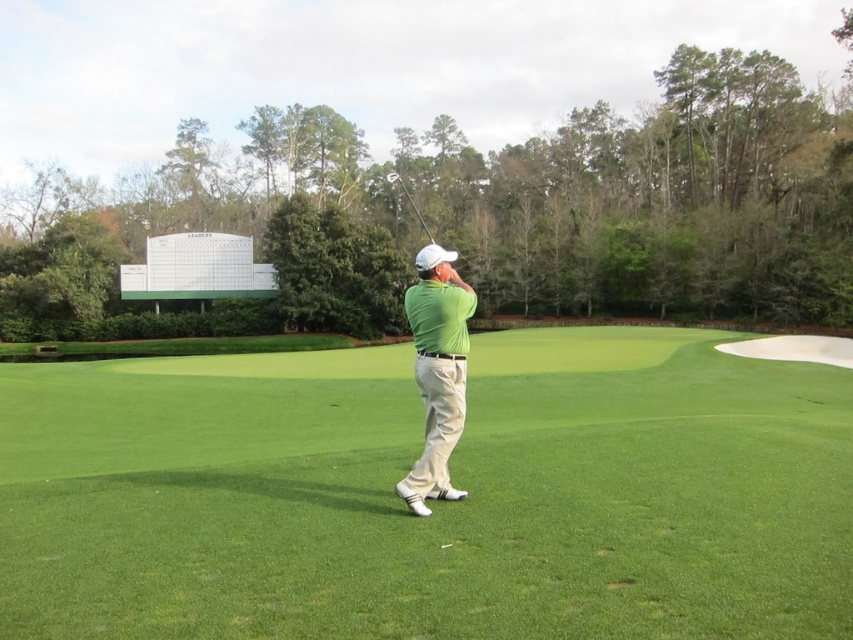
What is the 2D coordinate of the green grass at center in the image?

The green grass at center is located at the 2D coordinate point of (x=433, y=502).

You are a golfer standing on the green grass at center and wearing the green matte shirt at center. Do you think your shirt is taller than the grass around you?

The green grass at center is not as tall as green matte shirt at center, so yes, the green matte shirt at center is taller than the green grass at center.